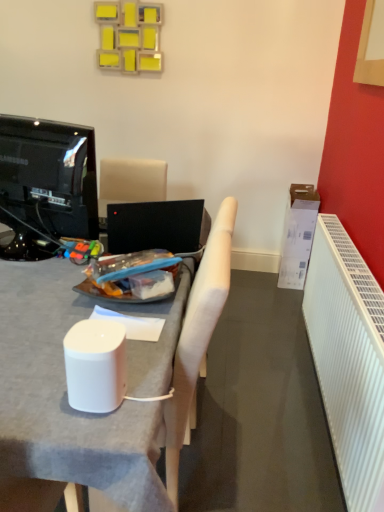
Where is `black glossy television at left`? This screenshot has width=384, height=512. black glossy television at left is located at coordinates (46, 185).

Measure the distance between point (300, 286) and camera.

Point (300, 286) is 9.62 feet away from camera.

Find the location of a particular element. white matte desk at center is located at coordinates (65, 397).

Describe the element at coordinates (348, 358) in the screenshot. The width and height of the screenshot is (384, 512). I see `white ribbed radiator at right` at that location.

Locate an element on the screen. black glossy television at left is located at coordinates (46, 185).

Is white fabric chair at center located within black glossy television at left?

That's incorrect, white fabric chair at center is not inside black glossy television at left.

Is black glossy television at left touching white fabric chair at center?

No, black glossy television at left is not with white fabric chair at center.

Considering the positions of point (86, 236) and point (205, 342), is point (86, 236) closer or farther from the camera than point (205, 342)?

Point (86, 236) is farther from the camera than point (205, 342).

From the image's perspective, is black glossy television at left under white fabric chair at center?

No, from the image's perspective, black glossy television at left is not beneath white fabric chair at center.

Identify the location of radiator to the left of white cardboard box at right. This screenshot has width=384, height=512. (348, 358).

Is white cardboard box at right oriented towards white ribbed radiator at right?

Yes, white cardboard box at right is oriented towards white ribbed radiator at right.

Are white cardboard box at right and white ribbed radiator at right located far from each other?

That's not correct — white cardboard box at right is a little close to white ribbed radiator at right.

Does white cardboard box at right come behind white ribbed radiator at right?

Yes, it is.

Could you tell me if white cardboard box at right is facing white fabric chair at center?

No, white cardboard box at right is not oriented towards white fabric chair at center.

Is white cardboard box at right bigger than white fabric chair at center?

Incorrect, white cardboard box at right is not larger than white fabric chair at center.

Can you confirm if white cardboard box at right is positioned to the right of white fabric chair at center?

Yes, white cardboard box at right is to the right of white fabric chair at center.

Are white cardboard box at right and white fabric chair at center located far from each other?

That's right, there is a large distance between white cardboard box at right and white fabric chair at center.

Which of these two, white fabric chair at center or white matte desk at center, is wider?

Wider between the two is white matte desk at center.

Find the location of a particular element. desk below the white fabric chair at center (from a real-world perspective) is located at coordinates (65, 397).

Could you tell me if white fabric chair at center is turned towards white matte desk at center?

Yes.

Can we say white fabric chair at center lies outside white matte desk at center?

No, most part of white fabric chair at center lies within white matte desk at center.

Can you confirm if white fabric chair at center is bigger than white ribbed radiator at right?

Yes.

Which point is more distant from viewer, (170, 475) or (379, 377)?

Point (379, 377)

Considering the sizes of white fabric chair at center and white ribbed radiator at right in the image, is white fabric chair at center wider or thinner than white ribbed radiator at right?

Considering their sizes, white fabric chair at center looks broader than white ribbed radiator at right.

Would you consider white fabric chair at center to be distant from white ribbed radiator at right?

white fabric chair at center is actually quite close to white ribbed radiator at right.

Based on their positions, is white cardboard box at right located to the left or right of black glossy television at left?

In the image, white cardboard box at right appears on the right side of black glossy television at left.

Is the depth of white cardboard box at right greater than that of black glossy television at left?

Yes.

From a real-world perspective, which is physically above, white cardboard box at right or black glossy television at left?

From a 3D spatial view, black glossy television at left is above.

Can you confirm if white cardboard box at right is shorter than black glossy television at left?

In fact, white cardboard box at right may be taller than black glossy television at left.

Looking at their sizes, would you say white cardboard box at right is wider or thinner than white matte desk at center?

In the image, white cardboard box at right appears to be more narrow than white matte desk at center.

Is white cardboard box at right far away from white matte desk at center?

Yes, white cardboard box at right and white matte desk at center are located far from each other.

In the scene shown: Who is taller, white cardboard box at right or white matte desk at center?

white matte desk at center.

From the image's perspective, does white cardboard box at right appear lower than white matte desk at center?

No.

Find the location of a particular element. chair below the black glossy television at left (from a real-world perspective) is located at coordinates (197, 336).

Identify the location of radiator in front of the white cardboard box at right. (348, 358).

When comparing their distances from white cardboard box at right, does black glossy television at left or white fabric chair at center seem closer?

white fabric chair at center is closer to white cardboard box at right.

Looking at the image, which one is located closer to white ribbed radiator at right, white matte desk at center or black glossy television at left?

white matte desk at center.

Based on their spatial positions, is white cardboard box at right or black glossy television at left further from white ribbed radiator at right?

Based on the image, black glossy television at left appears to be further to white ribbed radiator at right.

Based on their spatial positions, is white ribbed radiator at right or white matte desk at center closer to white cardboard box at right?

white ribbed radiator at right is closer to white cardboard box at right.

Looking at the image, which one is located further to white ribbed radiator at right, white fabric chair at center or white cardboard box at right?

white cardboard box at right is further to white ribbed radiator at right.

In the scene shown: Considering their positions, is white fabric chair at center positioned closer to white cardboard box at right than black glossy television at left?

Based on the image, white fabric chair at center appears to be nearer to white cardboard box at right.

Based on their spatial positions, is black glossy television at left or white cardboard box at right closer to white ribbed radiator at right?

The object closer to white ribbed radiator at right is white cardboard box at right.

Estimate the real-world distances between objects in this image. Which object is further from white fabric chair at center, white ribbed radiator at right or white cardboard box at right?

Among the two, white cardboard box at right is located further to white fabric chair at center.

Identify the location of television between white matte desk at center and white fabric chair at center from front to back. This screenshot has width=384, height=512. (46, 185).

This screenshot has height=512, width=384. What are the coordinates of `chair between black glossy television at left and white ribbed radiator at right in the horizontal direction` in the screenshot? It's located at (197, 336).

The image size is (384, 512). Find the location of `desk located between black glossy television at left and white ribbed radiator at right in the left-right direction`. desk located between black glossy television at left and white ribbed radiator at right in the left-right direction is located at coordinates (65, 397).

At what (x,y) coordinates should I click in order to perform the action: click on chair between black glossy television at left and white cardboard box at right in the front-back direction. Please return your answer as a coordinate pair (x, y). Image resolution: width=384 pixels, height=512 pixels. Looking at the image, I should click on (197, 336).